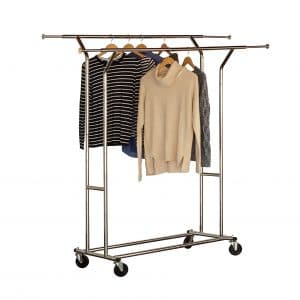
Where is `wheels on rolling hanger device`? This screenshot has width=300, height=300. wheels on rolling hanger device is located at coordinates (80, 261), (121, 271), (188, 239), (232, 251).